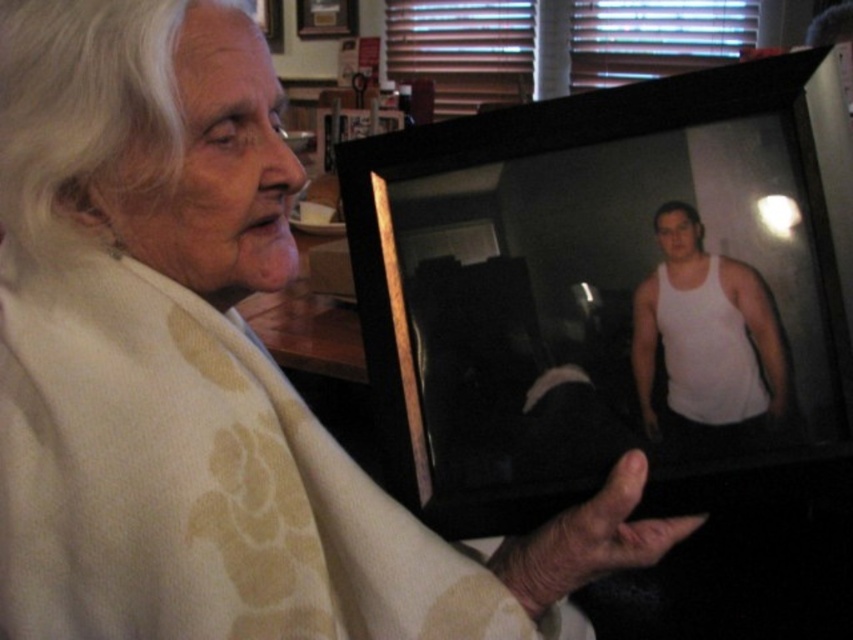
The elderly woman is holding a black plastic picture frame at center and looking at a white matte tank top at center in the photo. Which object is physically closer to her face?

The black plastic picture frame at center is physically closer to her face because it is closer to the viewer than the white matte tank top at center in the photo.

You are an interior designer assessing the dimensions of items in the image. The black plastic picture frame at center and the white matte tank top at center are both in view. Which object has a greater width?

The black plastic picture frame at center has a greater width than the white matte tank top at center.

You are a photographer trying to capture a closeup of the black plastic picture frame at center and the white matte tank top at center in the image. What is the minimum distance you need to maintain between the camera and the subject to ensure both are in focus?

The black plastic picture frame at center and white matte tank top at center are 2.68 inches apart from each other. To ensure both are in focus, the camera should be positioned at least 2.68 inches away from the closest subject.